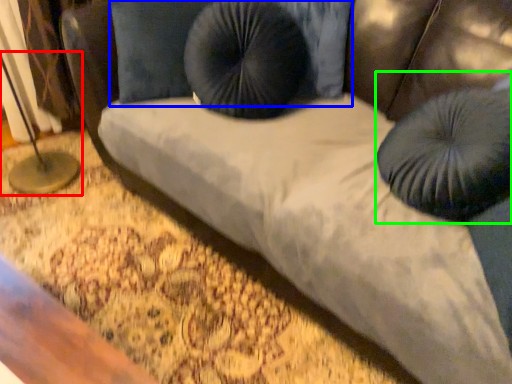
Question: Which object is positioned farthest from table lamp (highlighted by a red box)? Select from pillow (highlighted by a blue box) and bean bag chair (highlighted by a green box).

Choices:
 (A) pillow
 (B) bean bag chair

Answer: (B)